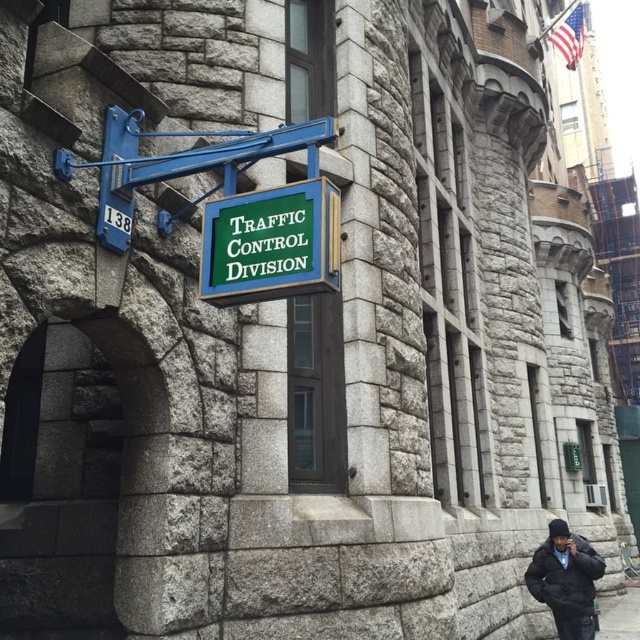
You are standing in front of the stone building and want to know which of the two points, point (243, 289) or point (548, 598), is closer to you. Based on the description, which point is closer?

Point (243, 289) is in front of point (548, 598), so it is closer to you.

Looking at this image, you are a delivery person approaching the building and see the black matte jacket at lower right and the gray concrete pavement at lower right. Which object is closer to you as you stand at the entrance?

The black matte jacket at lower right is closer to you because it is in front of the gray concrete pavement at lower right.

You are standing in front of the building and notice the black matte jacket at lower right and the gray concrete pavement at lower right. Which object is closer to the left side of the building?

The black matte jacket at lower right is positioned on the left side of gray concrete pavement at lower right, so it is closer to the left side of the building.